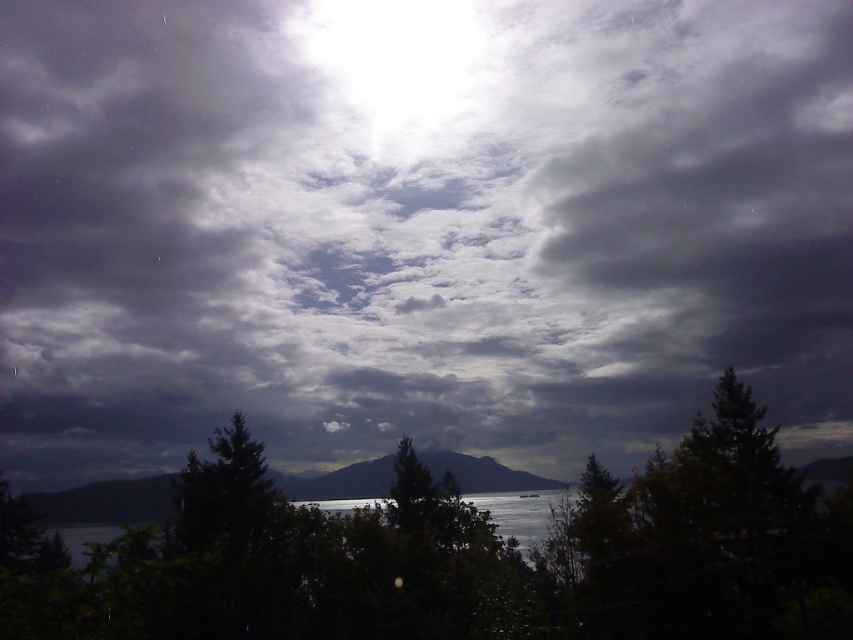
You are an outdoor photographer trying to capture the dramatic sky scene. You notice the green leafy tree at center and the dark gray rocky mountain at center. Which object is located to the right side of the other?

The green leafy tree at center is positioned on the right side of the dark gray rocky mountain at center.

You are standing in front of the dramatic sky scene with the dense green foliage in the foreground. You notice two points marked in the image. Which point, point (746, 596) or point (100, 483), is closer to you?

Point (746, 596) is closer to the viewer than point (100, 483).

You are standing in a field and see the green leafy tree at center in the distance. If you want to take a photo of it with your camera, which is 100 feet away from you, will the tree be in focus if your camera has a maximum focus range of 100 feet?

The green leafy tree at center is 100.26 feet away from the camera. Since the camera can only focus up to 100 feet, the tree is slightly beyond the maximum focus range and may not be in focus.